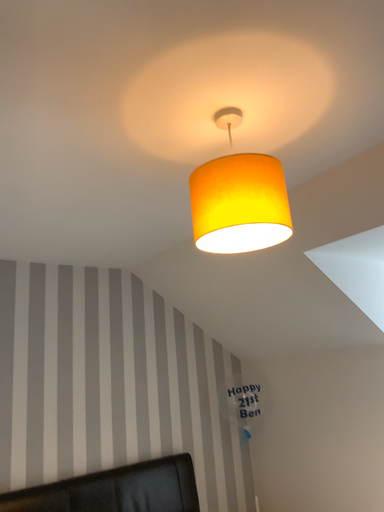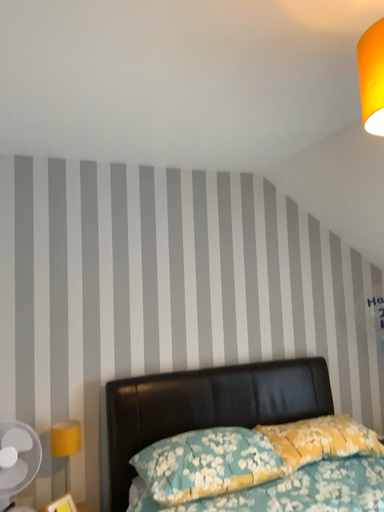
Question: How did the camera likely rotate when shooting the video?

Choices:
 (A) rotated left
 (B) rotated right

Answer: (A)